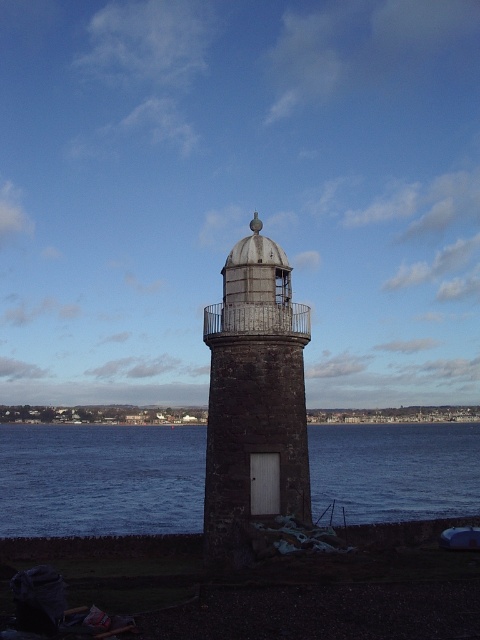
Between blue water at center and dark gray stone tower at center, which one appears on the left side from the viewer's perspective?

From the viewer's perspective, dark gray stone tower at center appears more on the left side.

Does blue water at center have a larger size compared to dark gray stone tower at center?

Yes.

Is point (88, 515) farther from camera compared to point (242, 403)?

Yes, it is.

What are the coordinates of `blue water at center` in the screenshot? It's located at (100, 480).